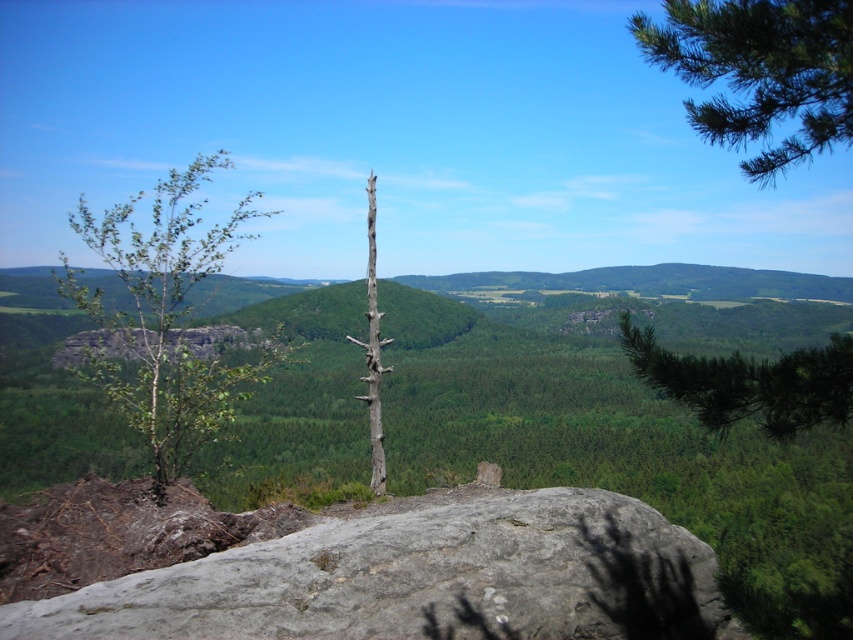
Question: Among these points, which one is nearest to the camera?

Choices:
 (A) (676, 12)
 (B) (465, 500)

Answer: (A)

Question: Is green needle-like at right positioned behind bare wood tree at center?

Choices:
 (A) no
 (B) yes

Answer: (A)

Question: Does gray rough rock at center lie in front of green needle-like branches at upper right?

Choices:
 (A) no
 (B) yes

Answer: (A)

Question: Is green needle-like at right positioned behind bare wood tree at center?

Choices:
 (A) no
 (B) yes

Answer: (A)

Question: Which of the following is the closest to the observer?

Choices:
 (A) (735, 104)
 (B) (668, 376)
 (C) (169, 464)

Answer: (B)

Question: Which point is closer to the camera taking this photo?

Choices:
 (A) (375, 356)
 (B) (689, 20)
 (C) (196, 592)
 (D) (207, 374)

Answer: (B)